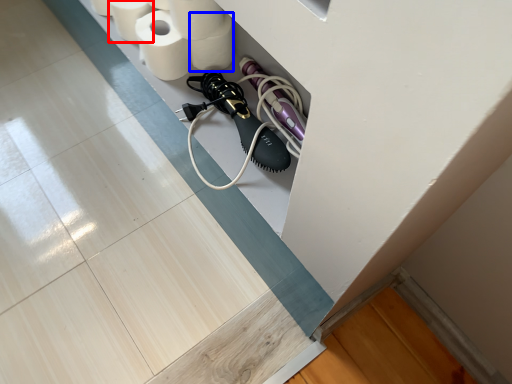
Question: Which object appears farthest to the camera in this image, toilet paper (highlighted by a red box) or toilet paper (highlighted by a blue box)?

Choices:
 (A) toilet paper
 (B) toilet paper

Answer: (A)